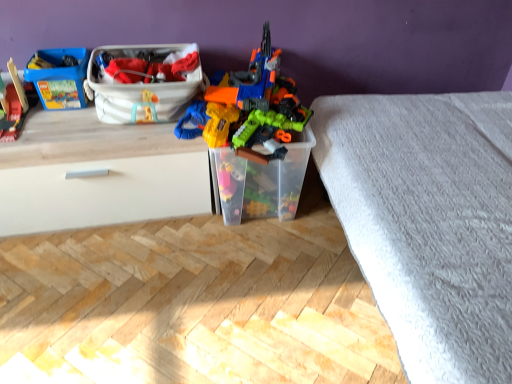
Measure the distance between translucent plastic toy at center, which is the second toy in left-to-right order, and camera.

The distance of translucent plastic toy at center, which is the second toy in left-to-right order, from camera is 4.73 feet.

Measure the distance between point (205,179) and camera.

1.73 meters.

This screenshot has width=512, height=384. I want to click on transparent plastic container at center, which appears as the 1th storage box when viewed from the right, so click(261, 181).

Find the location of a particular element. The height and width of the screenshot is (384, 512). translucent plastic toy at center, the first toy viewed from the right is located at coordinates (248, 108).

Consider the image. From the image's perspective, which one is positioned lower, white textured bed frame at lower right or wooden train at left, the 2th toy in the right-to-left sequence?

From the image's view, white textured bed frame at lower right is below.

Which object is wider, white textured bed frame at lower right or wooden train at left, which is counted as the first toy, starting from the left?

white textured bed frame at lower right is wider.

Can you tell me how much white textured bed frame at lower right and wooden train at left, the 2th toy in the right-to-left sequence, differ in facing direction?

The angle between the facing direction of white textured bed frame at lower right and the facing direction of wooden train at left, the 2th toy in the right-to-left sequence, is 90.8 degrees.

Which of these two, translucent plastic toy at center, which is the second toy in left-to-right order, or white matte drawer at left, is bigger?

Bigger between the two is white matte drawer at left.

Where is `toy that is on the right side of white matte drawer at left`? toy that is on the right side of white matte drawer at left is located at coordinates pos(248,108).

Is translucent plastic toy at center, the first toy viewed from the right, next to transparent plastic container at center, positioned as the third storage box in left-to-right order, and touching it?

translucent plastic toy at center, the first toy viewed from the right, and transparent plastic container at center, positioned as the third storage box in left-to-right order, are clearly separated.

From a real-world perspective, which object stands above the other?

In real-world perspective, translucent plastic toy at center, which is the second toy in left-to-right order, is above.

Is point (263, 126) behind point (217, 176)?

No, (263, 126) is in front of (217, 176).

From a real-world perspective, which object stands above the other?

In real-world perspective, white textured bed frame at lower right is above.

Where is `bed frame below the transparent plastic container at center, positioned as the third storage box in left-to-right order (from the image's perspective)`? This screenshot has width=512, height=384. bed frame below the transparent plastic container at center, positioned as the third storage box in left-to-right order (from the image's perspective) is located at coordinates (428, 222).

Considering the relative positions of transparent plastic container at center, positioned as the third storage box in left-to-right order, and white textured bed frame at lower right in the image provided, is transparent plastic container at center, positioned as the third storage box in left-to-right order, to the left of white textured bed frame at lower right from the viewer's perspective?

Yes.

Looking at the image, does transparent plastic container at center, positioned as the third storage box in left-to-right order, seem bigger or smaller compared to wooden train at left, the 2th toy in the right-to-left sequence?

Clearly, transparent plastic container at center, positioned as the third storage box in left-to-right order, is larger in size than wooden train at left, the 2th toy in the right-to-left sequence.

How many degrees apart are the facing directions of transparent plastic container at center, positioned as the third storage box in left-to-right order, and wooden train at left, the 2th toy in the right-to-left sequence?

The angular difference between transparent plastic container at center, positioned as the third storage box in left-to-right order, and wooden train at left, the 2th toy in the right-to-left sequence, is 0.913 degrees.

Considering the positions of points (264, 151) and (16, 117), is point (264, 151) closer to camera compared to point (16, 117)?

That is True.

From a real-world perspective, who is located higher, transparent plastic container at center, positioned as the third storage box in left-to-right order, or wooden train at left, which is counted as the first toy, starting from the left?

From a 3D spatial view, wooden train at left, which is counted as the first toy, starting from the left, is above.

Which of these two, white matte drawer at left or transparent plastic container at center, positioned as the third storage box in left-to-right order, is bigger?

white matte drawer at left is bigger.

Does white matte drawer at left turn towards transparent plastic container at center, positioned as the third storage box in left-to-right order?

No, white matte drawer at left does not turn towards transparent plastic container at center, positioned as the third storage box in left-to-right order.

Between white matte drawer at left and transparent plastic container at center, which appears as the 1th storage box when viewed from the right, which one has less height?

transparent plastic container at center, which appears as the 1th storage box when viewed from the right.

Is white matte drawer at left in front of or behind transparent plastic container at center, which appears as the 1th storage box when viewed from the right, in the image?

In the image, white matte drawer at left appears in front of transparent plastic container at center, which appears as the 1th storage box when viewed from the right.

Which of these two, matte plastic lego box at upper left, placed as the 1th storage box when sorted from left to right, or white textured bed frame at lower right, is bigger?

Bigger between the two is white textured bed frame at lower right.

Is matte plastic lego box at upper left, placed as the 1th storage box when sorted from left to right, further to the viewer compared to white textured bed frame at lower right?

Yes, matte plastic lego box at upper left, placed as the 1th storage box when sorted from left to right, is further from the viewer.

Is point (65, 78) closer or farther from the camera than point (360, 228)?

Point (65, 78) is positioned farther from the camera compared to point (360, 228).

Find the location of a particular element. This screenshot has height=384, width=512. bed frame located in front of the wooden train at left, which is counted as the first toy, starting from the left is located at coordinates (428, 222).

You are a GUI agent. You are given a task and a screenshot of the screen. Output one action in this format:
    pyautogui.click(x=<x>, y=<y>)
    Task: Click on the 2nd toy above the white matte drawer at left (from a real-world perspective)
    The width and height of the screenshot is (512, 384).
    Given the screenshot: What is the action you would take?
    pyautogui.click(x=248, y=108)

Based on their spatial positions, is white plastic storage box at upper center, which ranks as the 2th storage box in left-to-right order, or transparent plastic container at center, which appears as the 1th storage box when viewed from the right, closer to white matte drawer at left?

white plastic storage box at upper center, which ranks as the 2th storage box in left-to-right order.

Based on their spatial positions, is white matte drawer at left or wooden train at left, the 2th toy in the right-to-left sequence, further from matte plastic lego box at upper left, placed as the 1th storage box when sorted from left to right?

Based on the image, white matte drawer at left appears to be further to matte plastic lego box at upper left, placed as the 1th storage box when sorted from left to right.

When comparing their distances from white textured bed frame at lower right, does white matte drawer at left or white plastic storage box at upper center, which ranks as the 2th storage box in left-to-right order, seem closer?

Among the two, white plastic storage box at upper center, which ranks as the 2th storage box in left-to-right order, is located nearer to white textured bed frame at lower right.

Which object lies further to the anchor point white plastic storage box at upper center, which ranks as the 2th storage box in left-to-right order, transparent plastic container at center, positioned as the third storage box in left-to-right order, or wooden train at left, the 2th toy in the right-to-left sequence?

wooden train at left, the 2th toy in the right-to-left sequence, is further to white plastic storage box at upper center, which ranks as the 2th storage box in left-to-right order.

When comparing their distances from white plastic storage box at upper center, which ranks as the 2th storage box in left-to-right order, does matte plastic lego box at upper left, which appears as the third storage box when viewed from the right, or white matte drawer at left seem further?

white matte drawer at left is further to white plastic storage box at upper center, which ranks as the 2th storage box in left-to-right order.

From the image, which object appears to be nearer to matte plastic lego box at upper left, placed as the 1th storage box when sorted from left to right, wooden train at left, which is counted as the first toy, starting from the left, or translucent plastic toy at center, which is the second toy in left-to-right order?

The object closer to matte plastic lego box at upper left, placed as the 1th storage box when sorted from left to right, is wooden train at left, which is counted as the first toy, starting from the left.

Looking at the image, which one is located closer to wooden train at left, the 2th toy in the right-to-left sequence, translucent plastic toy at center, which is the second toy in left-to-right order, or transparent plastic container at center, positioned as the third storage box in left-to-right order?

translucent plastic toy at center, which is the second toy in left-to-right order, is closer to wooden train at left, the 2th toy in the right-to-left sequence.

Based on their spatial positions, is white plastic storage box at upper center, which ranks as the 2th storage box in left-to-right order, or white textured bed frame at lower right closer to translucent plastic toy at center, the first toy viewed from the right?

white plastic storage box at upper center, which ranks as the 2th storage box in left-to-right order, is closer to translucent plastic toy at center, the first toy viewed from the right.

Where is `drawer between matte plastic lego box at upper left, placed as the 1th storage box when sorted from left to right, and transparent plastic container at center, positioned as the third storage box in left-to-right order`? The height and width of the screenshot is (384, 512). drawer between matte plastic lego box at upper left, placed as the 1th storage box when sorted from left to right, and transparent plastic container at center, positioned as the third storage box in left-to-right order is located at coordinates (103, 193).

Locate an element on the screen. The image size is (512, 384). storage box situated between matte plastic lego box at upper left, which appears as the third storage box when viewed from the right, and translucent plastic toy at center, the first toy viewed from the right, from left to right is located at coordinates (143, 82).

Locate an element on the screen. toy situated between wooden train at left, the 2th toy in the right-to-left sequence, and white textured bed frame at lower right from left to right is located at coordinates (248, 108).

You are a GUI agent. You are given a task and a screenshot of the screen. Output one action in this format:
    pyautogui.click(x=<x>, y=<y>)
    Task: Click on the toy located between matte plastic lego box at upper left, placed as the 1th storage box when sorted from left to right, and transparent plastic container at center, which appears as the 1th storage box when viewed from the right, in the left-right direction
    
    Given the screenshot: What is the action you would take?
    pyautogui.click(x=248, y=108)